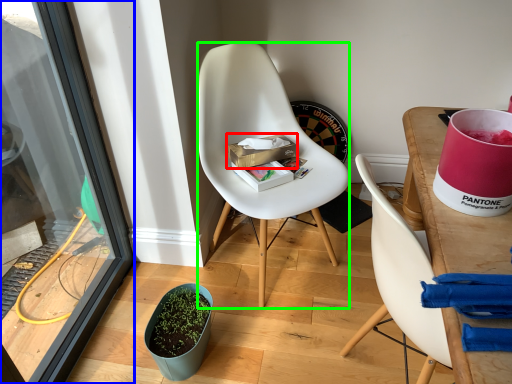
Question: Which object is positioned closest to box (highlighted by a red box)? Select from screen door (highlighted by a blue box) and chair (highlighted by a green box).

Choices:
 (A) screen door
 (B) chair

Answer: (B)